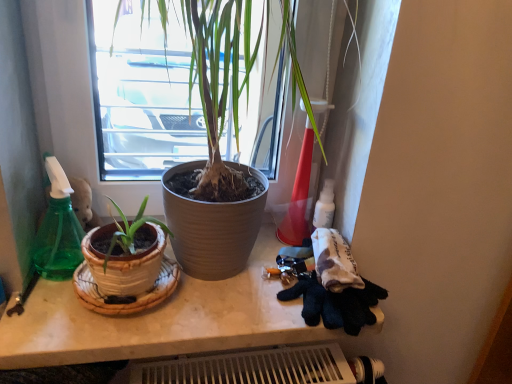
The image size is (512, 384). I want to click on white marble counter at center, so click(160, 321).

Describe the element at coordinates (160, 321) in the screenshot. I see `white marble counter at center` at that location.

Locate an element on the screen. The image size is (512, 384). green plastic spray bottle at left is located at coordinates (58, 230).

What do you see at coordinates (58, 230) in the screenshot? Image resolution: width=512 pixels, height=384 pixels. I see `green plastic spray bottle at left` at bounding box center [58, 230].

At what (x,y) coordinates should I click in order to perform the action: click on white marble counter at center. Please return your answer as a coordinate pair (x, y). Looking at the image, I should click on (160, 321).

In the scene shown: Is white marble counter at center to the left of green plastic spray bottle at left from the viewer's perspective?

No.

Considering the relative positions of white marble counter at center and green plastic spray bottle at left in the image provided, is white marble counter at center behind green plastic spray bottle at left?

No, it is not.

Considering the points (170, 316) and (54, 160), which point is in front, point (170, 316) or point (54, 160)?

Positioned in front is point (170, 316).

From the image's perspective, which one is positioned lower, white marble counter at center or green plastic spray bottle at left?

white marble counter at center is shown below in the image.

From a real-world perspective, relative to green plastic spray bottle at left, is white marble counter at center vertically above or below?

white marble counter at center is situated lower than green plastic spray bottle at left in the real world.

Can you confirm if white marble counter at center is wider than green plastic spray bottle at left?

Correct, the width of white marble counter at center exceeds that of green plastic spray bottle at left.

In the scene shown: Between white marble counter at center and green plastic spray bottle at left, which one has less height?

white marble counter at center.

Can you confirm if white marble counter at center is bigger than green plastic spray bottle at left?

Correct, white marble counter at center is larger in size than green plastic spray bottle at left.

Looking at this image, is green plastic spray bottle at left surrounded by white marble counter at center?

→ Definitely not — green plastic spray bottle at left is not inside white marble counter at center.

Is white marble counter at center positioned far away from green plastic spray bottle at left?

No, white marble counter at center is not far from green plastic spray bottle at left.

Consider the image. Does white marble counter at center turn towards green plastic spray bottle at left?

No.

Where is `bottle behind the white marble counter at center`? This screenshot has height=384, width=512. bottle behind the white marble counter at center is located at coordinates (58, 230).

Considering the relative positions of green plastic spray bottle at left and white marble counter at center in the image provided, is green plastic spray bottle at left to the right of white marble counter at center from the viewer's perspective?

Incorrect, green plastic spray bottle at left is not on the right side of white marble counter at center.

Is green plastic spray bottle at left in front of or behind white marble counter at center in the image?

Visually, green plastic spray bottle at left is located behind white marble counter at center.

Does point (59, 226) lie in front of point (219, 281)?

That is False.

From the image's perspective, would you say green plastic spray bottle at left is positioned over white marble counter at center?

Yes.

From a real-world perspective, is green plastic spray bottle at left physically above white marble counter at center?

Yes, from a real-world perspective, green plastic spray bottle at left is above white marble counter at center.

Between green plastic spray bottle at left and white marble counter at center, which one has larger width?

With larger width is white marble counter at center.

Between green plastic spray bottle at left and white marble counter at center, which one has less height?

With less height is white marble counter at center.

Considering the sizes of objects green plastic spray bottle at left and white marble counter at center in the image provided, who is smaller, green plastic spray bottle at left or white marble counter at center?

green plastic spray bottle at left is smaller.

Does green plastic spray bottle at left contain white marble counter at center?

Definitely not — white marble counter at center is not inside green plastic spray bottle at left.

Are green plastic spray bottle at left and white marble counter at center beside each other?

No, green plastic spray bottle at left is not making contact with white marble counter at center.

Could you tell me if green plastic spray bottle at left is turned towards white marble counter at center?

No.

What's the angular difference between green plastic spray bottle at left and white marble counter at center's facing directions?

There is a 0.268-degree angle between the facing directions of green plastic spray bottle at left and white marble counter at center.

Find the location of a particular element. This screenshot has width=512, height=384. bottle above the white marble counter at center (from a real-world perspective) is located at coordinates (58, 230).

Locate an element on the screen. The image size is (512, 384). bottle above the white marble counter at center (from a real-world perspective) is located at coordinates (58, 230).

Locate an element on the screen. counter lying below the green plastic spray bottle at left (from the image's perspective) is located at coordinates (160, 321).